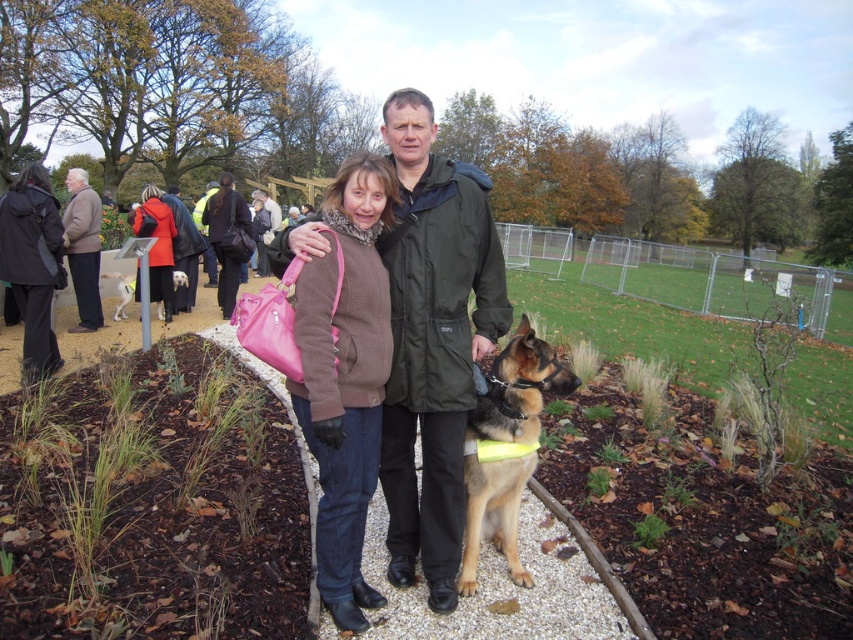
Does brown fuzzy sweater at center have a greater width compared to dark gray wool coat at left?

Incorrect, brown fuzzy sweater at center's width does not surpass dark gray wool coat at left's.

Is brown fuzzy sweater at center to the left of dark gray wool coat at left from the viewer's perspective?

In fact, brown fuzzy sweater at center is to the right of dark gray wool coat at left.

Between point (346, 464) and point (33, 273), which one is positioned in front?

Point (346, 464)

Image resolution: width=853 pixels, height=640 pixels. I want to click on brown fuzzy sweater at center, so click(345, 378).

Which of these two, matte pink handbag at center or white fur dog at left, stands taller?

matte pink handbag at center is taller.

Is matte pink handbag at center wider than white fur dog at left?

Yes, matte pink handbag at center is wider than white fur dog at left.

Image resolution: width=853 pixels, height=640 pixels. I want to click on matte pink handbag at center, so click(x=157, y=244).

At what (x,y) coordinates should I click in order to perform the action: click on matte pink handbag at center. Please return your answer as a coordinate pair (x, y). Looking at the image, I should click on (157, 244).

In the scene shown: Which of these two, brown fuzzy sweater at center or brown fur dog at center, stands taller?

With more height is brown fuzzy sweater at center.

Measure the distance between brown fuzzy sweater at center and camera.

brown fuzzy sweater at center is 2.45 meters from camera.

In order to click on brown fuzzy sweater at center in this screenshot , I will do `click(345, 378)`.

In order to click on brown fuzzy sweater at center in this screenshot , I will do `click(345, 378)`.